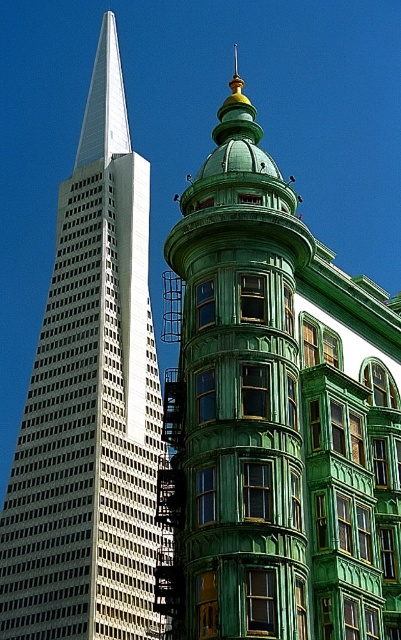
You are an architect analyzing the spatial relationship between the green glossy building at center and the white glass skyscraper at left. Based on the scene, which building is situated lower in elevation compared to the other?

The green glossy building at center is positioned under the white glass skyscraper at left, meaning it is lower in elevation than the skyscraper.

Looking at this image, you are standing at the base of the modern skyscraper and want to look at two points in the image. The first point is labeled as point (330, 625) and the second is point (62, 454). Which of these points will appear closer to you when viewed from your current position?

Point (330, 625) will appear closer to you because it is in front of point (62, 454).

You are an architect evaluating the spatial compatibility of two buildings. The green glossy building at center and the white glass skyscraper at left are part of a new urban development plan. Based on their widths, which building should be placed closer to a narrow alleyway to ensure adequate space?

The white glass skyscraper at left should be placed closer to the narrow alleyway since it might be narrower than the green glossy building at center, allowing for better space management in tight areas.